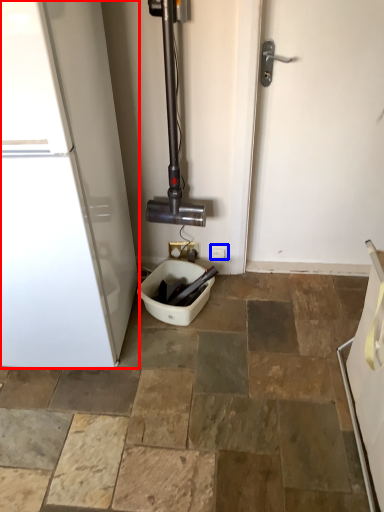
Question: Which point is closer to the camera, home appliance (highlighted by a red box) or electric outlet (highlighted by a blue box)?

Choices:
 (A) home appliance
 (B) electric outlet

Answer: (A)